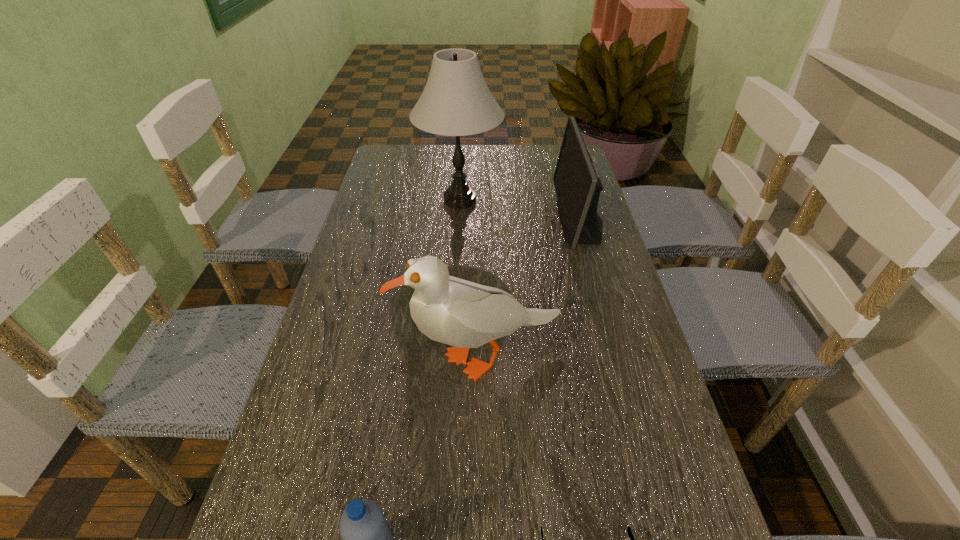
At what (x,y) coordinates should I click in order to perform the action: click on the tallest object. Please return your answer as a coordinate pair (x, y). Looking at the image, I should click on (456, 101).

Identify the location of the third farthest object. (450, 310).

This screenshot has width=960, height=540. Find the location of `the fourth shortest object`. the fourth shortest object is located at coordinates (450, 310).

Locate an element on the screen. The height and width of the screenshot is (540, 960). computer monitor is located at coordinates (577, 186).

Locate an element on the screen. The height and width of the screenshot is (540, 960). the third shortest object is located at coordinates (577, 186).

Identify the location of vacant region located on the back of the lamp. The image size is (960, 540). (x=462, y=172).

In order to click on free space located 0.200m at the beak of the gull in this screenshot , I will do `click(314, 359)`.

In order to click on free region located on the screen side of the computer monitor in this screenshot , I will do `click(487, 221)`.

Locate an element on the screen. This screenshot has width=960, height=540. vacant region located on the screen side of the computer monitor is located at coordinates (536, 221).

Identify the location of vacant area situated 0.340m on the screen side of the computer monitor. This screenshot has width=960, height=540. (447, 221).